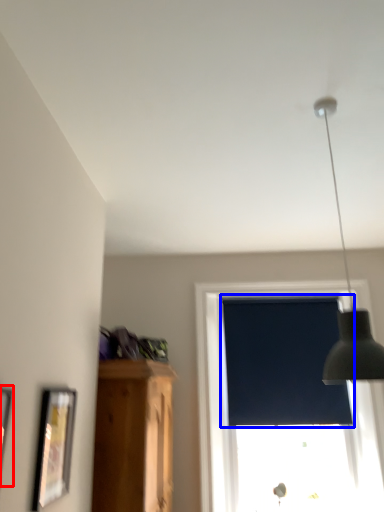
Question: Which object appears farthest to the camera in this image, picture frame (highlighted by a red box) or window screen (highlighted by a blue box)?

Choices:
 (A) picture frame
 (B) window screen

Answer: (B)